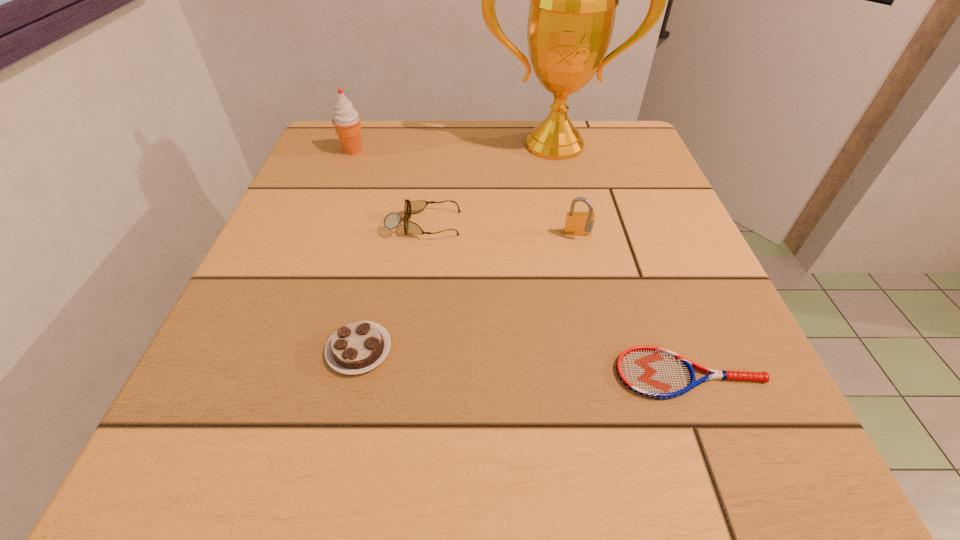
Where is `free space located 0.060m on the front-facing side of the third shortest object`? free space located 0.060m on the front-facing side of the third shortest object is located at coordinates [x=494, y=224].

This screenshot has width=960, height=540. I want to click on free spot located on the back of the chocolate cake, so click(398, 178).

Image resolution: width=960 pixels, height=540 pixels. Find the location of `vacant space located 0.080m on the left of the tennis racket`. vacant space located 0.080m on the left of the tennis racket is located at coordinates (555, 374).

Find the location of a particular element. award that is at the far edge is located at coordinates (573, 0).

Identify the location of icecream that is at the far edge. (346, 120).

This screenshot has height=540, width=960. In order to click on icecream at the left edge in this screenshot , I will do [x=346, y=120].

At what (x,y) coordinates should I click in order to perform the action: click on chocolate cake positioned at the left edge. Please return your answer as a coordinate pair (x, y). Image resolution: width=960 pixels, height=540 pixels. Looking at the image, I should click on (357, 347).

This screenshot has width=960, height=540. I want to click on award that is at the right edge, so click(573, 0).

Where is `tennis racket that is at the right edge`? The width and height of the screenshot is (960, 540). tennis racket that is at the right edge is located at coordinates (650, 371).

The height and width of the screenshot is (540, 960). What are the coordinates of `object located in the far left corner section of the desktop` in the screenshot? It's located at (346, 120).